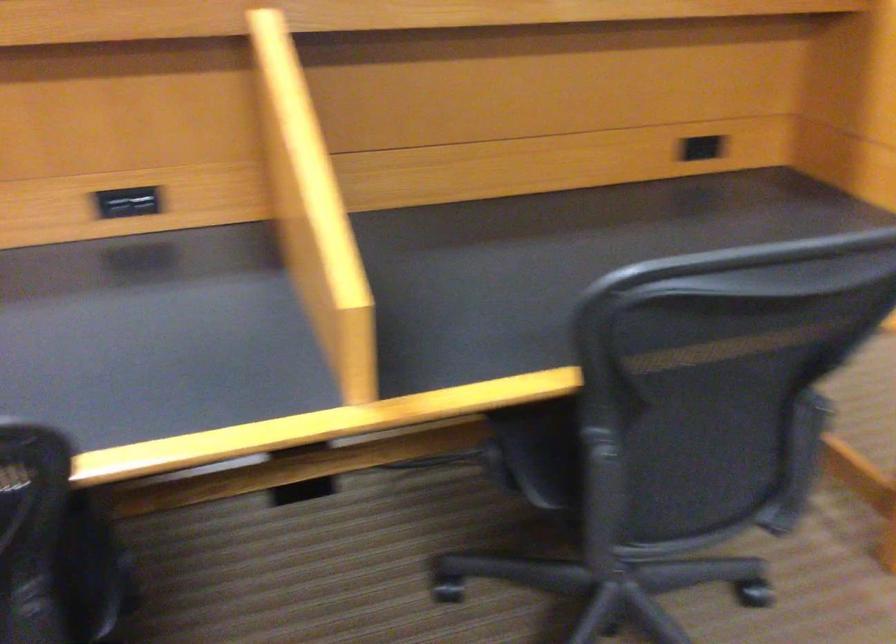
This screenshot has height=644, width=896. What do you see at coordinates (549, 448) in the screenshot?
I see `the chair sitting surface` at bounding box center [549, 448].